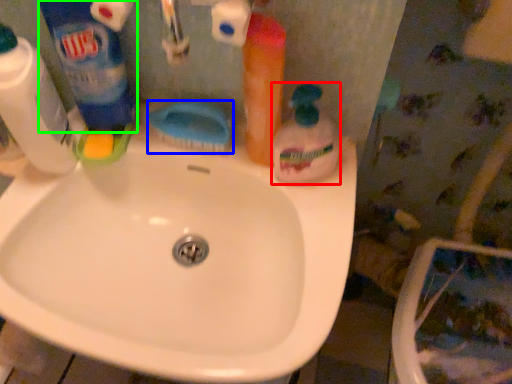
Question: Based on their relative distances, which object is nearer to cleaning product (highlighted by a red box)? Choose from brush (highlighted by a blue box) and cleaning product (highlighted by a green box).

Choices:
 (A) brush
 (B) cleaning product

Answer: (A)